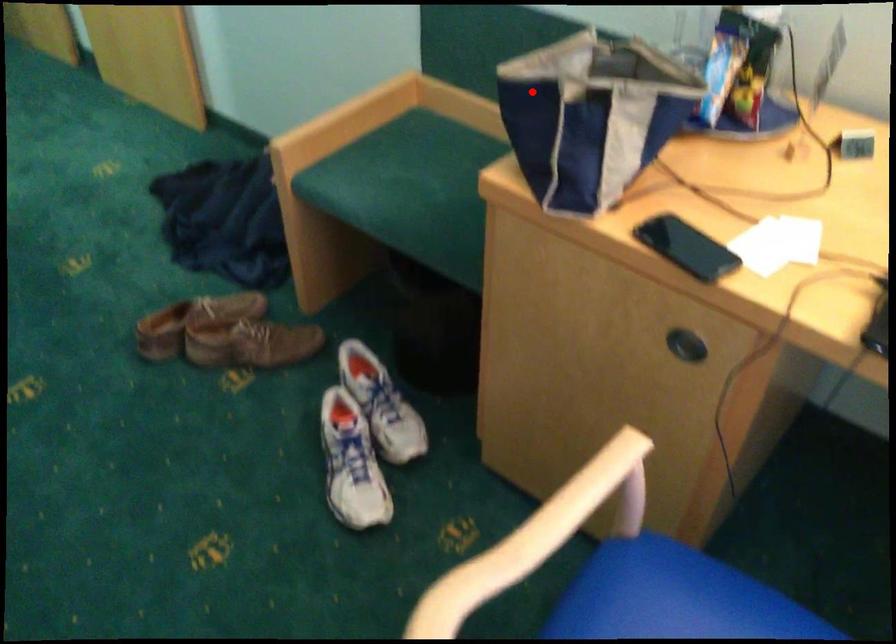
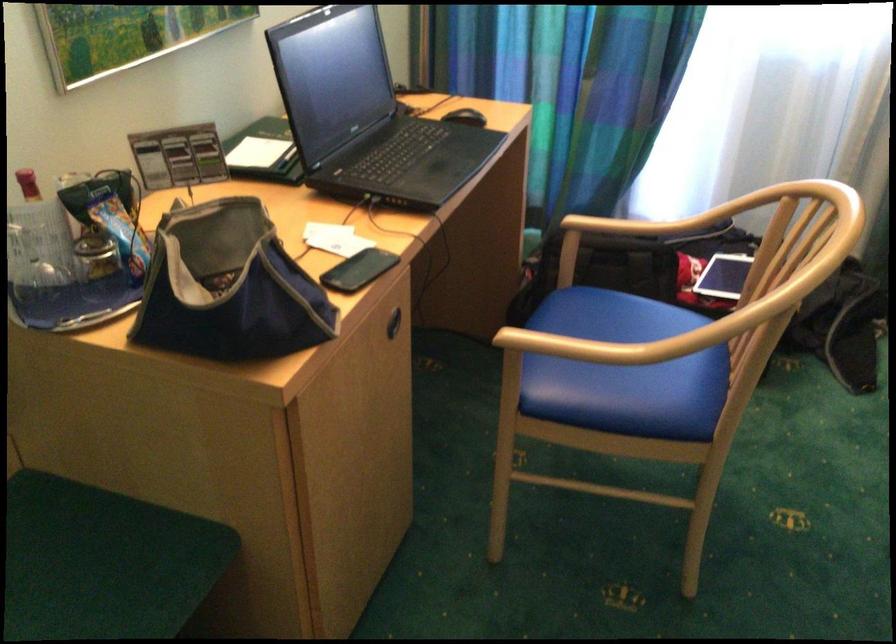
Question: I am providing you with two images of the same scene from different viewpoints. Given a red point in image1, look at the same physical point in image2. Is it:

Choices:
 (A) Closer to the viewpoint
 (B) Farther from the viewpoint

Answer: (A)